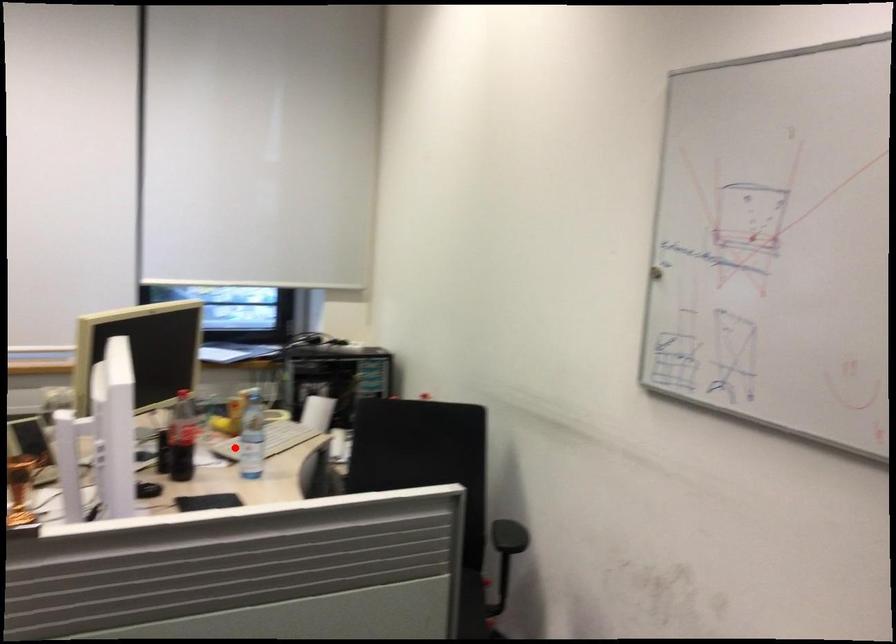
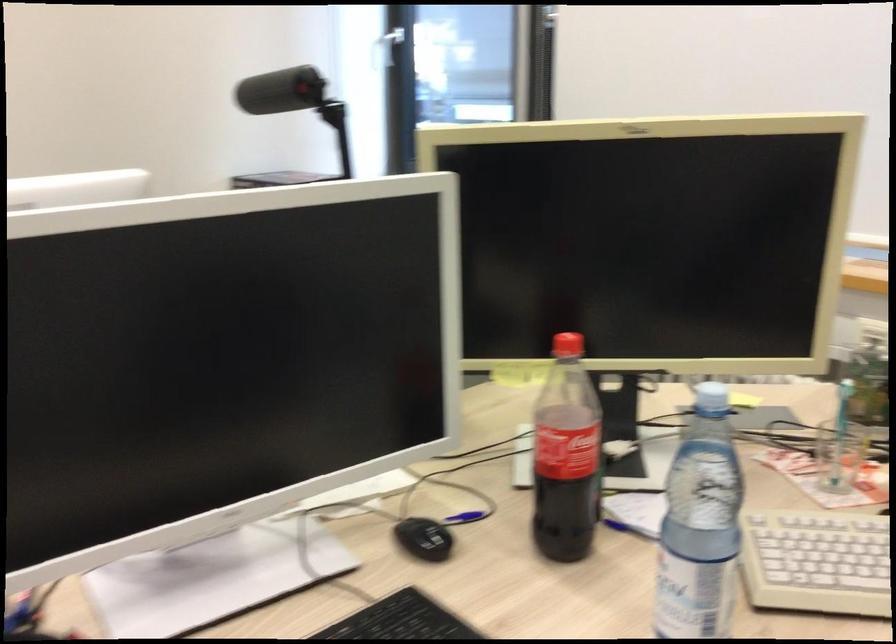
Locate, in the second image, the point that corresponds to the highlighted location in the first image.

(815, 562)